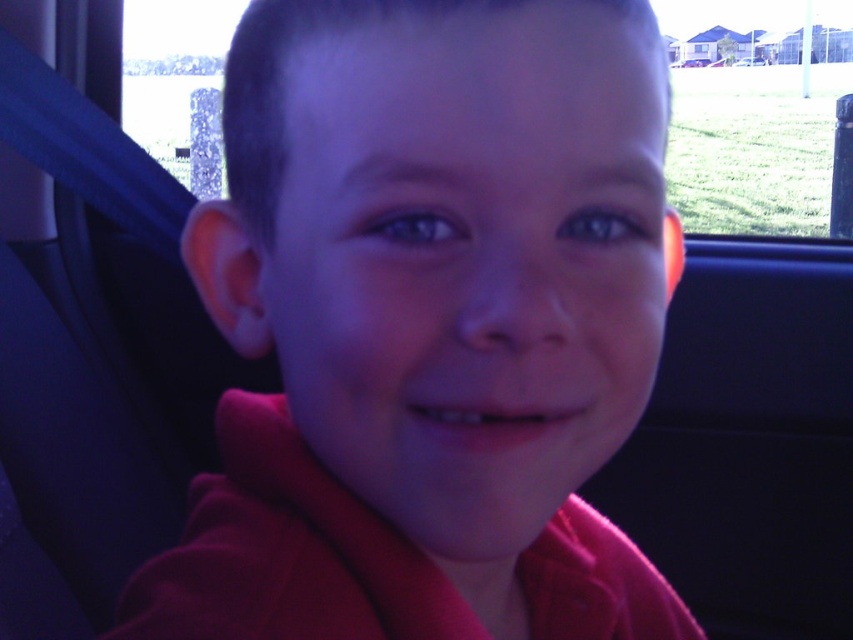
You are a photographer trying to capture a clear image of the matte red shirt at center. Considering the distance between you and the shirt, would you need to adjust your camera focus to ensure sharpness?

The matte red shirt at center is 23.77 centimeters from the viewer. Since most cameras have an autofocus system that can handle distances this close, you likely do not need to manually adjust the focus. However, if the camera struggles, you might want to switch to macro mode or adjust the focus settings manually to ensure clarity.

You are a safety inspector checking the visibility of the car windows. You notice the matte red shirt at center and the transparent glass car window at upper center. Which object has a smaller width?

The matte red shirt at center is thinner than the transparent glass car window at upper center, so the matte red shirt at center has a smaller width.

You are a driver looking at the rearview mirror and see the matte red shirt at center and the transparent glass car window at upper center. Which object appears shorter in the mirror?

The matte red shirt at center appears shorter than the transparent glass car window at upper center because it has a lesser height compared to it.